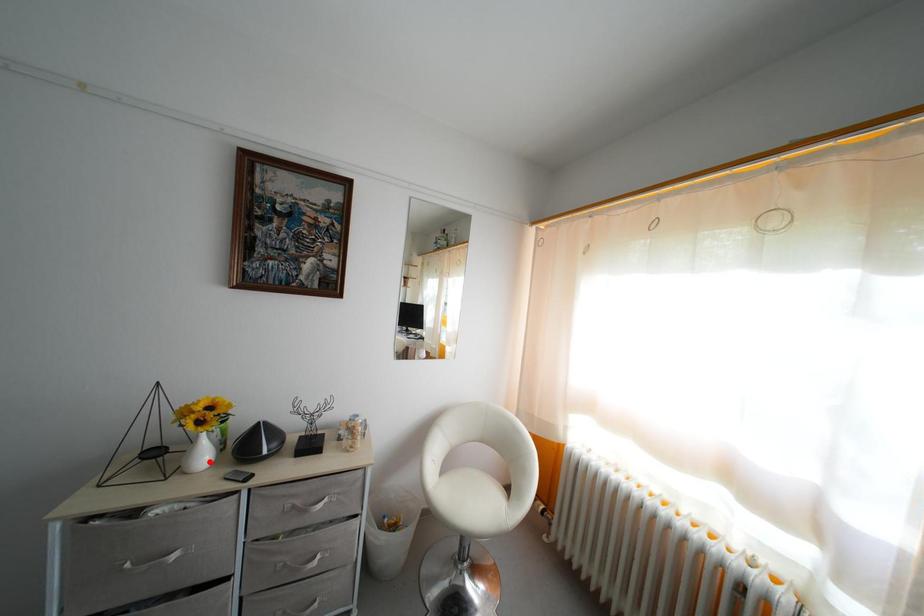
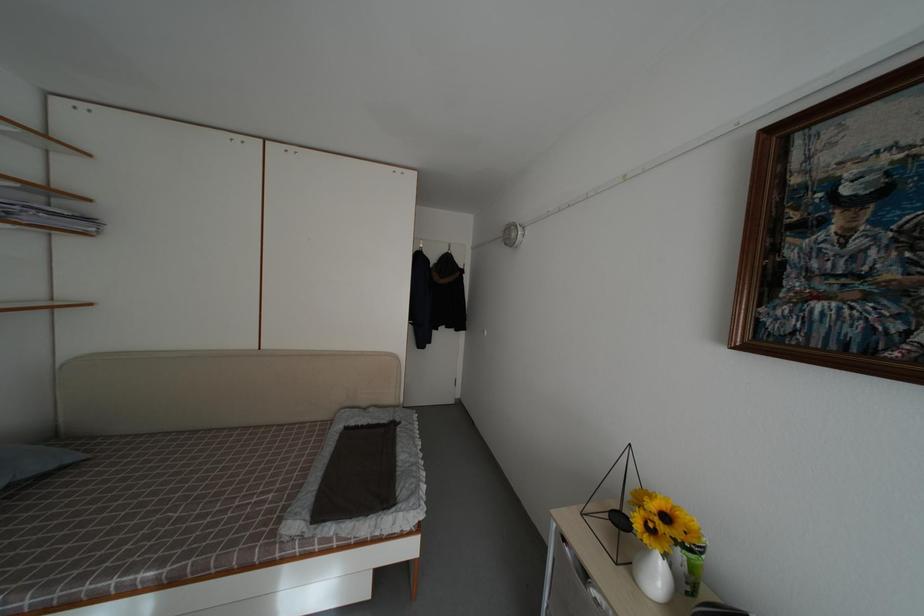
Locate, in the second image, the point that corresponds to the highlighted location in the first image.

(664, 584)